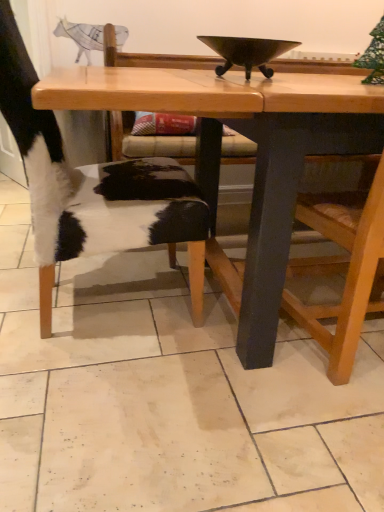
Find the location of a particular element. This screenshot has width=384, height=512. unoccupied area in front of cowhide leather chair at left is located at coordinates (108, 425).